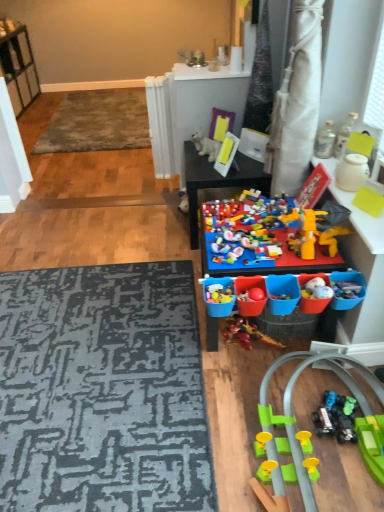
Question: Is translucent glass bottle at upper right, which is the 2th toy in top-to-bottom order, located within multicolored plastic toy at center?

Choices:
 (A) no
 (B) yes

Answer: (A)

Question: Is the position of multicolored plastic toy at center less distant than that of translucent glass bottle at upper right, which is the 2th toy in top-to-bottom order?

Choices:
 (A) yes
 (B) no

Answer: (B)

Question: Is multicolored plastic toy at center at the left side of translucent glass bottle at upper right, which is the 2th toy in top-to-bottom order?

Choices:
 (A) yes
 (B) no

Answer: (A)

Question: Are multicolored plastic toy at center and translucent glass bottle at upper right, the sixth toy in the bottom-to-top sequence, located far from each other?

Choices:
 (A) no
 (B) yes

Answer: (A)

Question: Is multicolored plastic toy at center thinner than translucent glass bottle at upper right, which is the 2th toy in top-to-bottom order?

Choices:
 (A) yes
 (B) no

Answer: (B)

Question: Is multicolored plastic toy at center positioned behind translucent glass bottle at upper right, the sixth toy in the bottom-to-top sequence?

Choices:
 (A) no
 (B) yes

Answer: (B)

Question: From the image's perspective, would you say white plastic shelf at upper left is shown under metallic glass bottle at upper right, the third toy in the top-to-bottom sequence?

Choices:
 (A) yes
 (B) no

Answer: (B)

Question: Does white plastic shelf at upper left have a lesser width compared to metallic glass bottle at upper right, the third toy in the top-to-bottom sequence?

Choices:
 (A) no
 (B) yes

Answer: (A)

Question: Is white plastic shelf at upper left aimed at metallic glass bottle at upper right, the 5th toy ordered from the bottom?

Choices:
 (A) yes
 (B) no

Answer: (B)

Question: Is white plastic shelf at upper left facing away from metallic glass bottle at upper right, the third toy in the top-to-bottom sequence?

Choices:
 (A) yes
 (B) no

Answer: (B)

Question: Is the position of white plastic shelf at upper left less distant than that of metallic glass bottle at upper right, the third toy in the top-to-bottom sequence?

Choices:
 (A) no
 (B) yes

Answer: (A)

Question: Considering the relative sizes of white plastic shelf at upper left and metallic glass bottle at upper right, the third toy in the top-to-bottom sequence, in the image provided, is white plastic shelf at upper left bigger than metallic glass bottle at upper right, the third toy in the top-to-bottom sequence,?

Choices:
 (A) no
 (B) yes

Answer: (B)

Question: Does multicolored plastic toy at center, the 2th toy positioned from the bottom, turn towards translucent glass bottle at upper right, which is the 2th toy in top-to-bottom order?

Choices:
 (A) yes
 (B) no

Answer: (B)